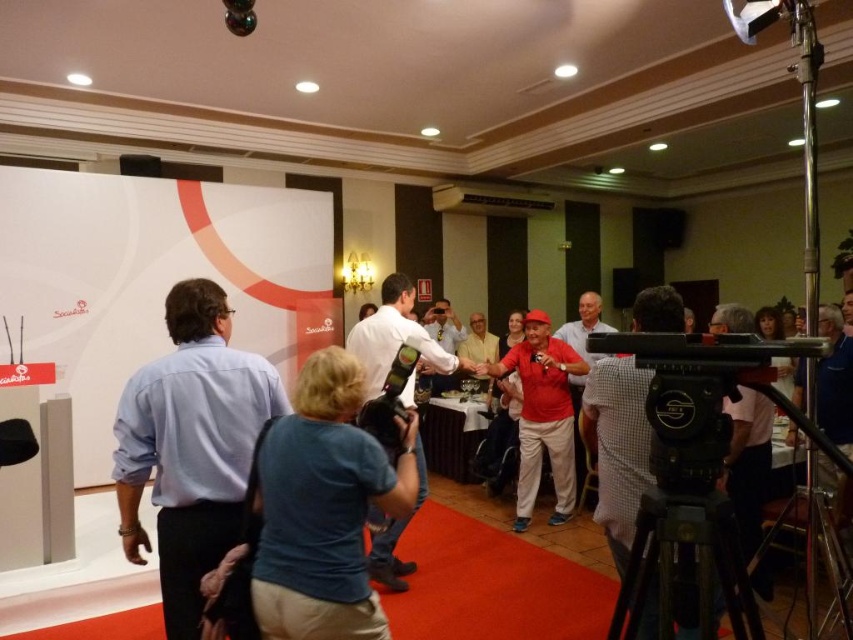
Consider the image. You are a photographer standing behind the table at the event. You want to take a photo that includes both the blue cotton shirt at center and the red matte shirt at center. What is the minimum distance you need to step back from the table to ensure both shirts are in the frame?

The minimum distance you need to step back from the table to include both the blue cotton shirt at center and the red matte shirt at center in the frame is at least 2.59 meters, as that is the distance between them.

You are organizing an event and need to place a 1.2 meter wide banner between the blue cotton shirt at center and the black matte tripod at lower right. Can you fit it there based on their widths?

The blue cotton shirt at center is wider than the black matte tripod at lower right. However, the combined width of both objects would need to be considered to determine if there is enough space. Since the banner is 1.2 meters wide, but the exact widths of the objects are not provided, it is impossible to accurately assess whether the banner will fit without additional measurements.